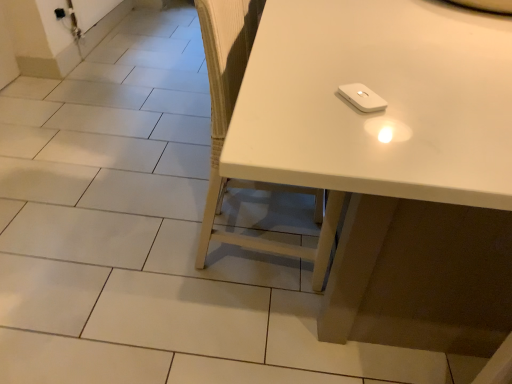
Question: Is white matte chair at center thinner than white matte wii controller at upper center?

Choices:
 (A) no
 (B) yes

Answer: (A)

Question: From the image's perspective, is white matte chair at center beneath white matte wii controller at upper center?

Choices:
 (A) yes
 (B) no

Answer: (A)

Question: Is the position of white matte chair at center less distant than that of white matte wii controller at upper center?

Choices:
 (A) yes
 (B) no

Answer: (B)

Question: Is white matte chair at center outside white matte wii controller at upper center?

Choices:
 (A) no
 (B) yes

Answer: (B)

Question: Can you confirm if white matte chair at center is smaller than white matte wii controller at upper center?

Choices:
 (A) no
 (B) yes

Answer: (A)

Question: From their relative heights in the image, would you say white matte wii controller at upper center is taller or shorter than white matte chair at center?

Choices:
 (A) tall
 (B) short

Answer: (B)

Question: Is white matte wii controller at upper center wider or thinner than white matte chair at center?

Choices:
 (A) wide
 (B) thin

Answer: (B)

Question: Is white matte wii controller at upper center bigger or smaller than white matte chair at center?

Choices:
 (A) big
 (B) small

Answer: (B)

Question: Relative to white matte chair at center, is white matte wii controller at upper center in front or behind?

Choices:
 (A) front
 (B) behind

Answer: (A)

Question: From the image's perspective, is white glossy table at upper right above or below white matte wii controller at upper center?

Choices:
 (A) below
 (B) above

Answer: (B)

Question: Does point (342, 278) appear closer or farther from the camera than point (371, 104)?

Choices:
 (A) farther
 (B) closer

Answer: (A)

Question: Is white glossy table at upper right taller or shorter than white matte wii controller at upper center?

Choices:
 (A) tall
 (B) short

Answer: (A)

Question: Is white glossy table at upper right wider or thinner than white matte wii controller at upper center?

Choices:
 (A) wide
 (B) thin

Answer: (A)

Question: In terms of height, does white matte chair at center look taller or shorter compared to white matte wii controller at upper center?

Choices:
 (A) short
 (B) tall

Answer: (B)

Question: In the image, is white matte chair at center positioned in front of or behind white matte wii controller at upper center?

Choices:
 (A) front
 (B) behind

Answer: (B)